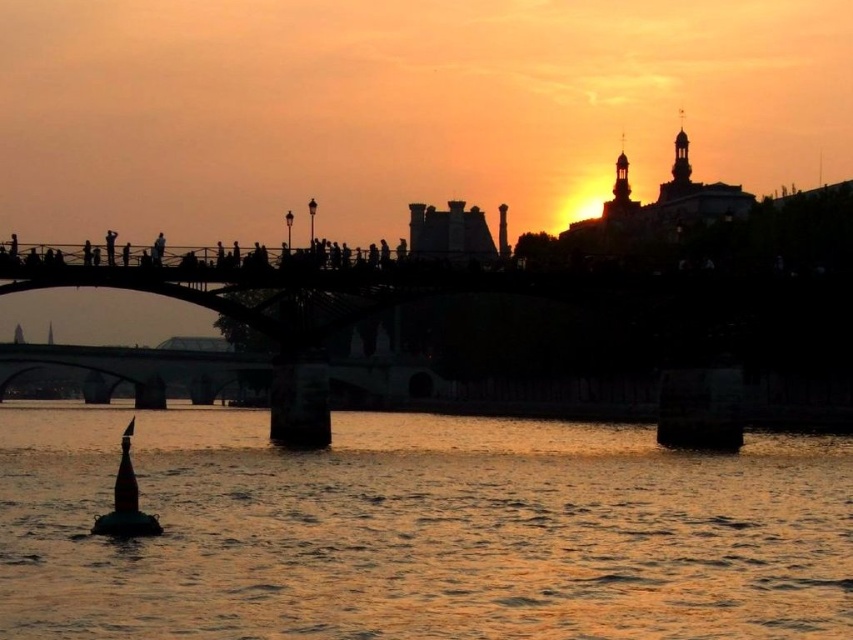
Question: Does golden reflective water at center have a smaller size compared to reddish-brown wooden buoy at lower left?

Choices:
 (A) yes
 (B) no

Answer: (B)

Question: Among these points, which one is nearest to the camera?

Choices:
 (A) (119, 532)
 (B) (656, 472)

Answer: (A)

Question: Is golden reflective water at center behind reddish-brown wooden buoy at lower left?

Choices:
 (A) no
 (B) yes

Answer: (A)

Question: Is golden reflective water at center below reddish-brown wooden buoy at lower left?

Choices:
 (A) no
 (B) yes

Answer: (B)